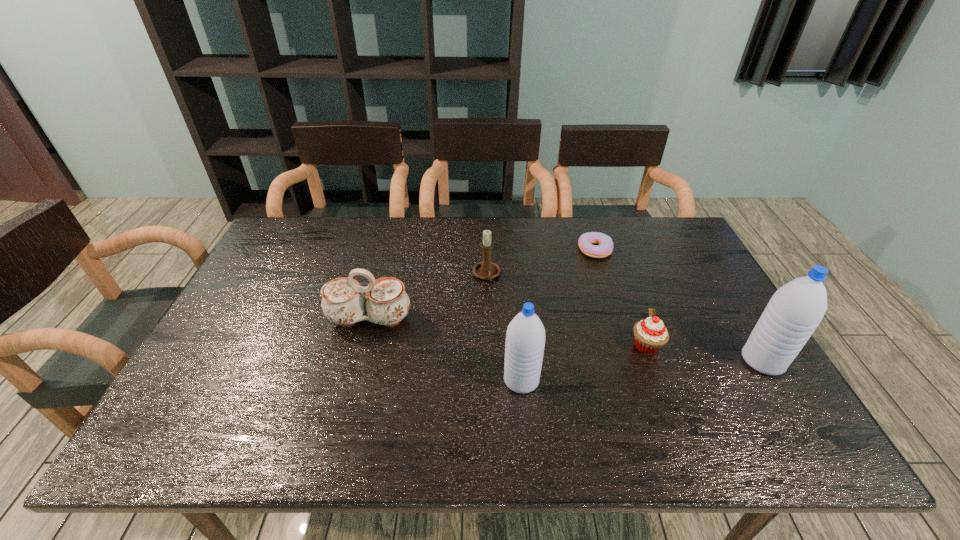
In order to click on vacant space at the left edge of the desktop in this screenshot , I will do `click(274, 287)`.

This screenshot has height=540, width=960. In order to click on vacant space at the right edge in this screenshot , I will do `click(696, 269)`.

Locate an element on the screen. The height and width of the screenshot is (540, 960). free space at the far left corner is located at coordinates (305, 254).

Locate an element on the screen. free space at the far right corner of the desktop is located at coordinates (647, 252).

The width and height of the screenshot is (960, 540). I want to click on free space that is in between the cupcake and the rightmost object, so click(x=705, y=353).

Identify the location of blank region between the fifth nearest object and the fifth tallest object. (566, 310).

Locate an element on the screen. The image size is (960, 540). free area in between the farthest object and the fifth shortest object is located at coordinates (558, 315).

Locate an element on the screen. The image size is (960, 540). unoccupied area between the cupcake and the fifth shortest object is located at coordinates (584, 363).

Identify the location of unoccupied position between the candle holder and the chinaware. Image resolution: width=960 pixels, height=540 pixels. (428, 298).

Locate an element on the screen. free space between the cupcake and the rightmost object is located at coordinates (705, 353).